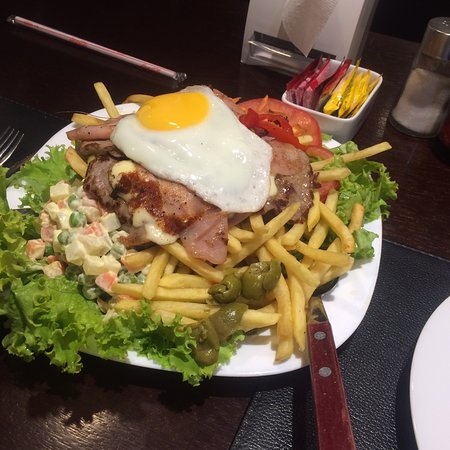
I want to click on salt shaker, so click(427, 95).